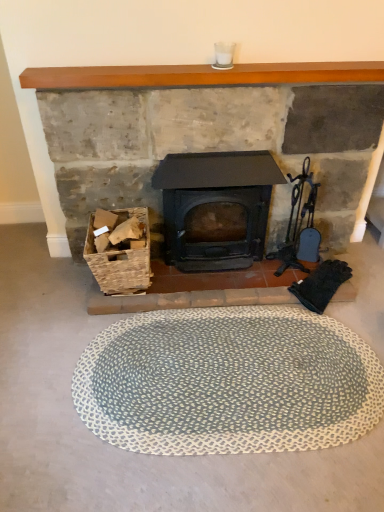
The image size is (384, 512). What are the coordinates of `vacant space underneath matte black wood burning stove at center (from a real-world perspective)` in the screenshot? It's located at (213, 270).